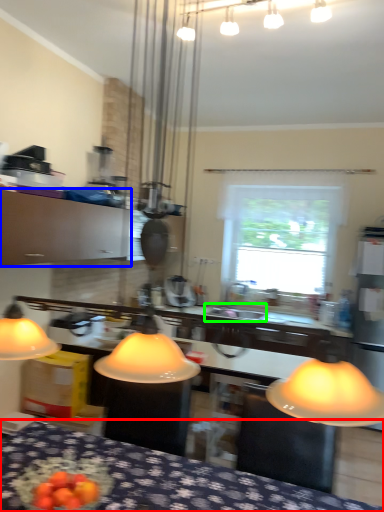
Question: Based on their relative distances, which object is farther from furniture (highlighted by a red box)? Choose from cabinetry (highlighted by a blue box) and sink (highlighted by a green box).

Choices:
 (A) cabinetry
 (B) sink

Answer: (A)